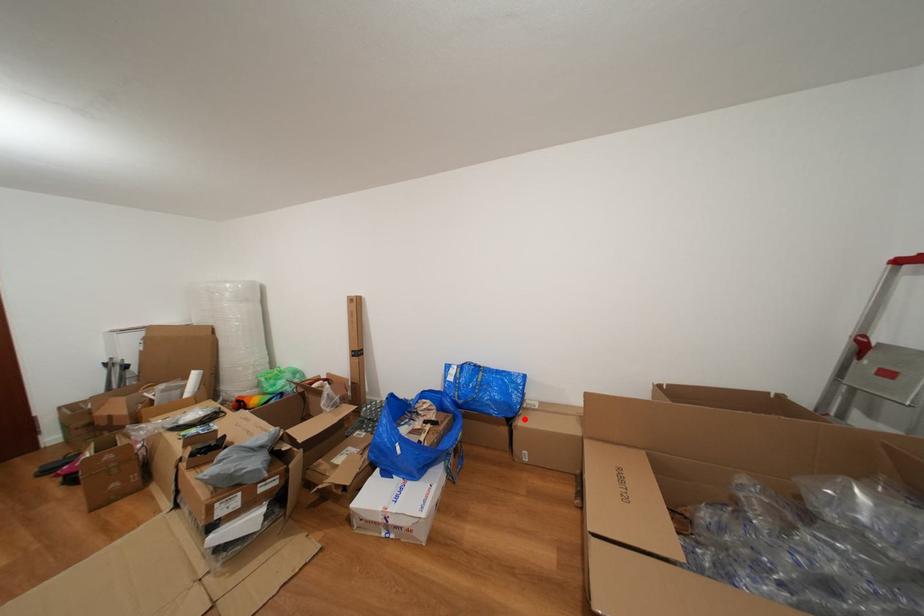
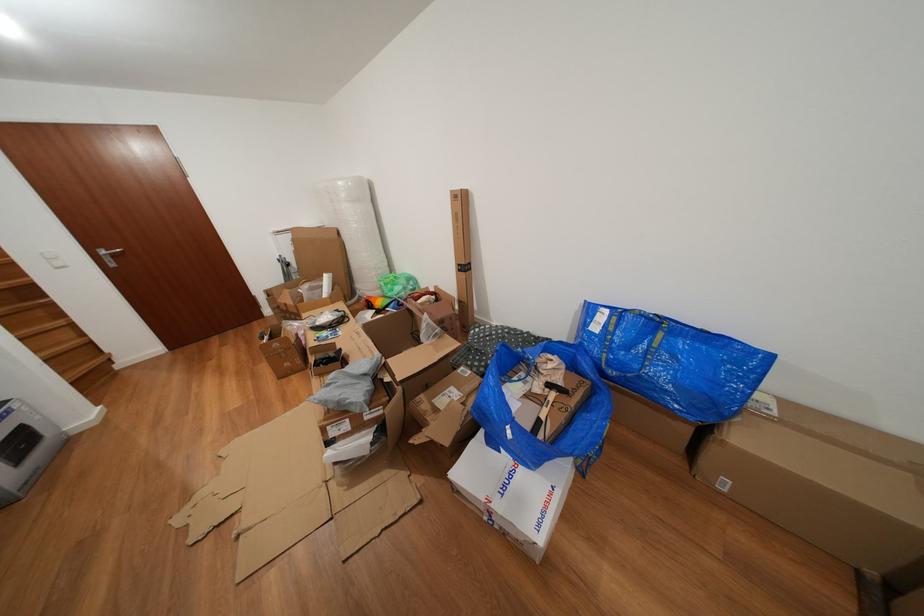
Question: I am providing you with two images of the same scene from different viewpoints. In image1, a red point is highlighted. Considering the same 3D point in image2, which of the following is correct?

Choices:
 (A) It is closer
 (B) It is farther

Answer: (A)